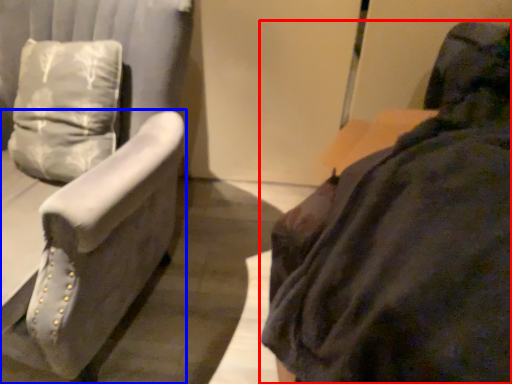
Question: Among these objects, which one is nearest to the camera, furniture (highlighted by a red box) or furniture (highlighted by a blue box)?

Choices:
 (A) furniture
 (B) furniture

Answer: (A)